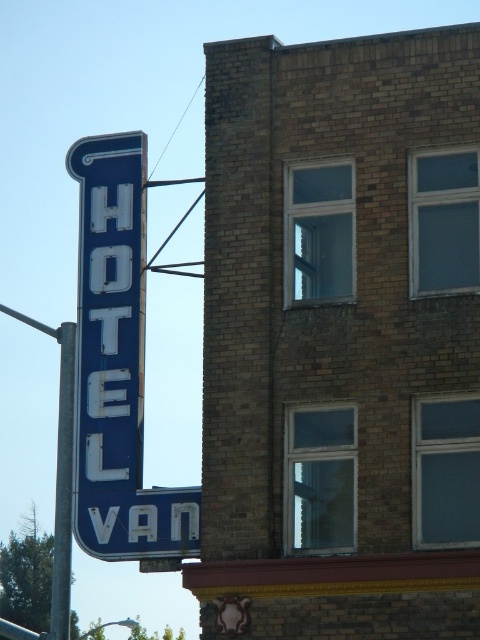
You are a painter standing in front of the building. You need to paint both the blue metallic sign at left and the metallic pole at left. Which one should you paint first if you want to paint the object that is closer to you?

The blue metallic sign at left is in front of the metallic pole at left, so you should paint the blue metallic sign at left first since it is closer to you.

You are standing at a point 64.73 meters away from the brick building with the vintage hotel sign. If you look directly at the building, where would you see the point marked at coordinates point (140, 336) located in relation to the hotel sign?

The point marked at coordinates point (140, 336) is located 64.73 meters away from the camera, so it would be positioned directly at the center of the hotel sign mounted on the brick building.

You are standing in front of a brick building with a vintage hotel sign. You want to take a photo of the blue metallic sign at left without any obstructions. Considering the distance, is it possible to capture the entire sign in your camera frame from your current position?

The blue metallic sign at left is 60.58 meters from camera, so it might be too far to capture the entire sign in your camera frame without obstructions. You may need to move closer or use a zoom lens.